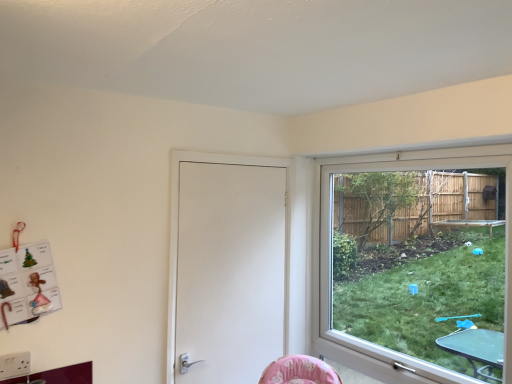
Identify the location of clear glass window at right. (416, 264).

What do you see at coordinates (416, 264) in the screenshot? I see `clear glass window at right` at bounding box center [416, 264].

Describe the element at coordinates (178, 226) in the screenshot. I see `white matte door at center` at that location.

The height and width of the screenshot is (384, 512). What are the coordinates of `white matte door at center` in the screenshot? It's located at (178, 226).

Identify the location of clear glass window at right. (416, 264).

Can you confirm if clear glass window at right is positioned to the left of white matte door at center?

Incorrect, clear glass window at right is not on the left side of white matte door at center.

In the image, is clear glass window at right positioned in front of or behind white matte door at center?

Visually, clear glass window at right is located in front of white matte door at center.

Is point (447, 324) closer to camera compared to point (288, 331)?

Yes, point (447, 324) is in front of point (288, 331).

From the image's perspective, is clear glass window at right under white matte door at center?

No, from the image's perspective, clear glass window at right is not beneath white matte door at center.

From a real-world perspective, is clear glass window at right located beneath white matte door at center?

No.

Is clear glass window at right wider than white matte door at center?

Yes.

Considering the sizes of objects clear glass window at right and white matte door at center in the image provided, who is shorter, clear glass window at right or white matte door at center?

white matte door at center is shorter.

From the picture: Is clear glass window at right bigger or smaller than white matte door at center?

clear glass window at right is bigger than white matte door at center.

Can white matte door at center be found inside clear glass window at right?

Actually, white matte door at center is outside clear glass window at right.

Consider the image. Is there a large distance between clear glass window at right and white matte door at center?

No, clear glass window at right is in close proximity to white matte door at center.

Does clear glass window at right turn towards white matte door at center?

Yes, clear glass window at right is oriented towards white matte door at center.

At what (x,y) coordinates should I click in order to perform the action: click on window that appears on the right of white matte door at center. Please return your answer as a coordinate pair (x, y). The width and height of the screenshot is (512, 384). Looking at the image, I should click on (416, 264).

Is white matte door at center to the left of clear glass window at right from the viewer's perspective?

Indeed, white matte door at center is positioned on the left side of clear glass window at right.

Consider the image. Is white matte door at center behind clear glass window at right?

Yes, white matte door at center is further from the camera.

Which is less distant, (289, 170) or (402, 336)?

Point (289, 170) appears to be farther away from the viewer than point (402, 336).

From the image's perspective, who appears lower, white matte door at center or clear glass window at right?

white matte door at center appears lower in the image.

From a real-world perspective, is white matte door at center above or below clear glass window at right?

Clearly, from a real-world perspective, white matte door at center is below clear glass window at right.

Is white matte door at center thinner than clear glass window at right?

Indeed, white matte door at center has a lesser width compared to clear glass window at right.

Which of these two, white matte door at center or clear glass window at right, stands shorter?

white matte door at center.

Is white matte door at center smaller than clear glass window at right?

Correct, white matte door at center occupies less space than clear glass window at right.

Is clear glass window at right surrounded by white matte door at center?

That's incorrect, clear glass window at right is not inside white matte door at center.

Would you consider white matte door at center to be distant from clear glass window at right?

Actually, white matte door at center and clear glass window at right are a little close together.

Is white matte door at center turned away from clear glass window at right?

white matte door at center does not have its back to clear glass window at right.

Can you tell me how much white matte door at center and clear glass window at right differ in facing direction?

The angular difference between white matte door at center and clear glass window at right is 89.4 degrees.

Find the location of a particular element. window in front of the white matte door at center is located at coordinates (416, 264).

This screenshot has height=384, width=512. In the image, there is a clear glass window at right. In order to click on door below it (from the image's perspective) in this screenshot , I will do `click(178, 226)`.

At what (x,y) coordinates should I click in order to perform the action: click on window located above the white matte door at center (from the image's perspective). Please return your answer as a coordinate pair (x, y). This screenshot has width=512, height=384. Looking at the image, I should click on (416, 264).